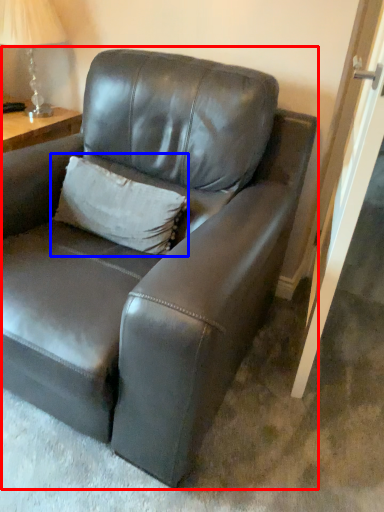
Question: Which object is closer to the camera taking this photo, studio couch (highlighted by a red box) or pillow (highlighted by a blue box)?

Choices:
 (A) studio couch
 (B) pillow

Answer: (A)